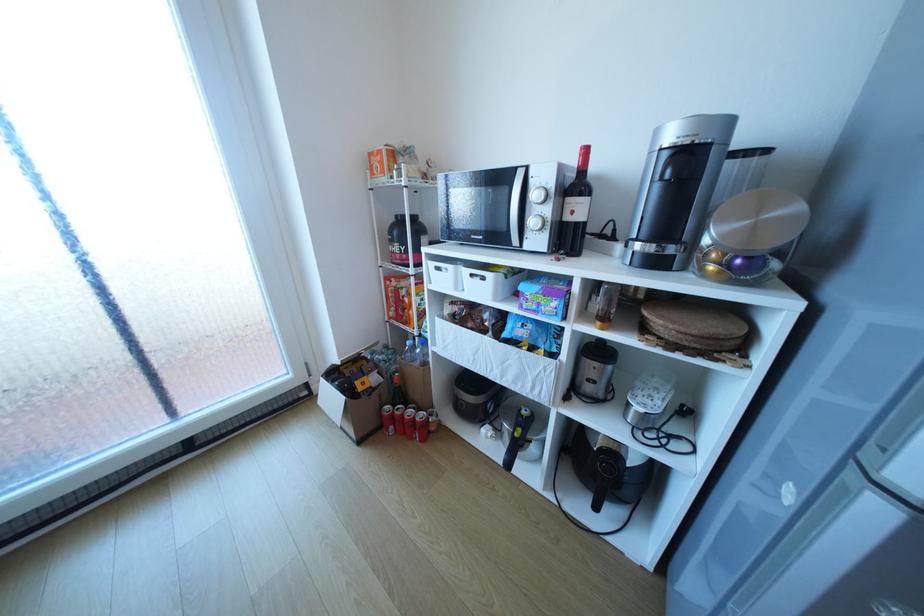
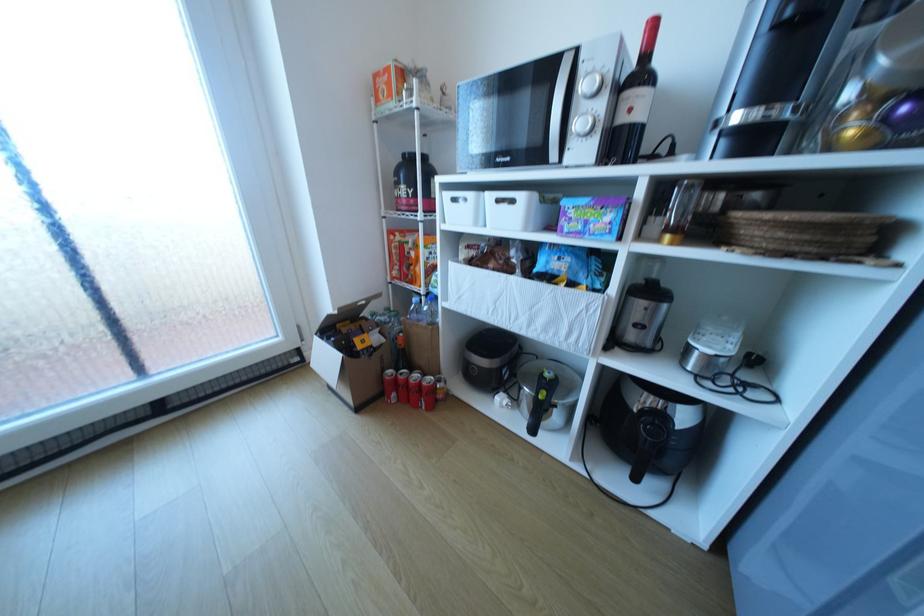
In a continuous first-person perspective shot, in which direction is the camera moving?

The cameraman walked toward left, forward.